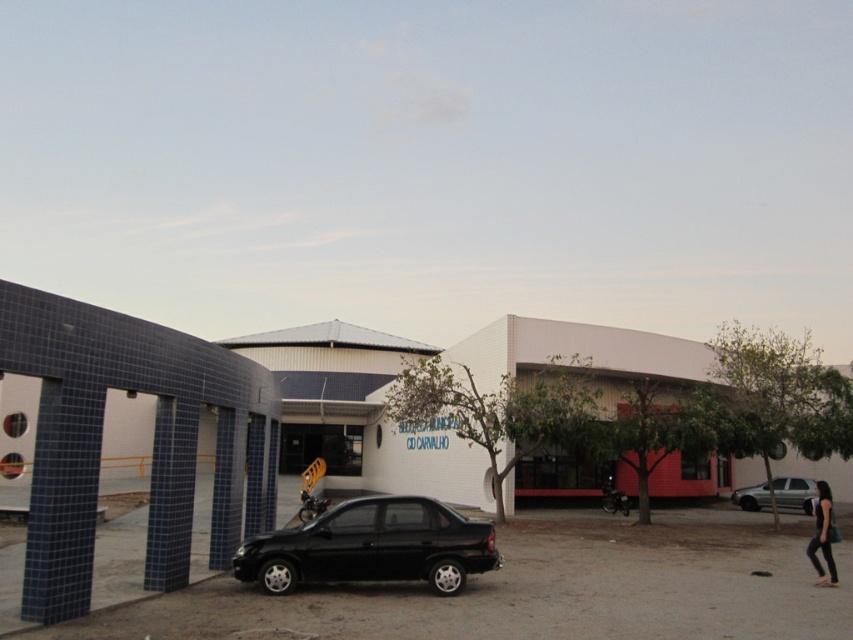
You are standing next to the camera and want to take a photo of the black matte sedan at center. If your camera can capture objects up to 10 meters away clearly, will you be able to take a clear photo?

The black matte sedan at center and camera are 10.90 meters apart. Since the distance is more than 10 meters, the camera cannot capture the black matte sedan at center clearly within the clear range.

You are standing at the entrance of the building complex and want to park your car at the exact center of the complex. The black matte sedan at center is currently blocking the way. Where should you move it to so that it no longer blocks the entrance?

The black matte sedan at center is located at point (372, 547). To unblock the entrance, move it to a position that is not in the center, such as towards the edges of the complex.